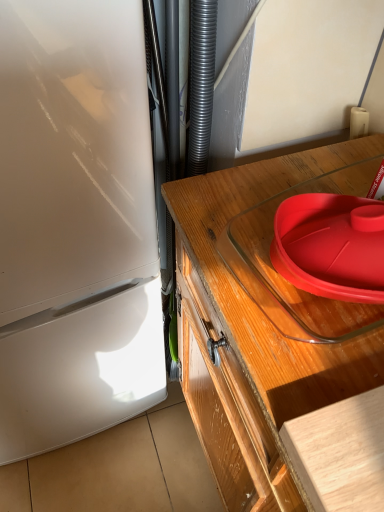
Question: Is point [x=281, y=372] positioned closer to the camera than point [x=299, y=272]?

Choices:
 (A) farther
 (B) closer

Answer: (B)

Question: From the image's perspective, relative to red plastic lid at upper right, is transparent glass tray at upper right above or below?

Choices:
 (A) below
 (B) above

Answer: (A)

Question: Is transparent glass tray at upper right taller or shorter than red plastic lid at upper right?

Choices:
 (A) tall
 (B) short

Answer: (A)

Question: Do you think red plastic lid at upper right is within transparent glass tray at upper right, or outside of it?

Choices:
 (A) inside
 (B) outside

Answer: (A)

Question: In the image, is red plastic lid at upper right positioned in front of or behind transparent glass tray at upper right?

Choices:
 (A) behind
 (B) front

Answer: (A)

Question: From the image's perspective, relative to transparent glass tray at upper right, is red plastic lid at upper right above or below?

Choices:
 (A) above
 (B) below

Answer: (A)

Question: Is red plastic lid at upper right bigger or smaller than transparent glass tray at upper right?

Choices:
 (A) small
 (B) big

Answer: (A)